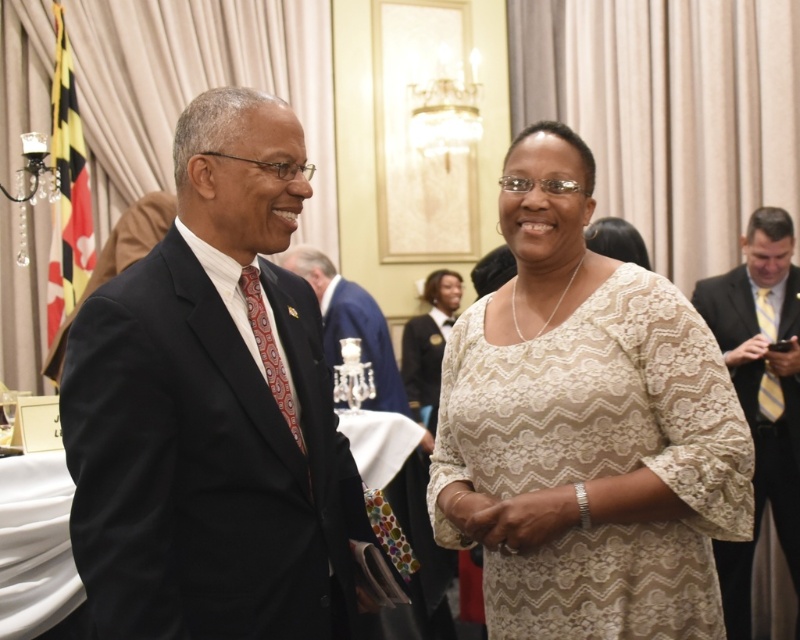
Question: From the image, what is the correct spatial relationship of lace dress at center in relation to matte black suit at center?

Choices:
 (A) right
 (B) left

Answer: (A)

Question: Which of these objects is positioned closest to the lace dress at center?

Choices:
 (A) dark blue suit at center
 (B) matte black suit at center

Answer: (A)

Question: Which is nearer to the lace dress at center?

Choices:
 (A) yellow striped tie at right
 (B) matte black suit at center
 (C) dark blue suit at center

Answer: (C)

Question: Which of the following is the closest to the observer?

Choices:
 (A) yellow striped tie at right
 (B) matte black suit at center
 (C) lace dress at center

Answer: (C)

Question: Can you confirm if lace dress at center is positioned to the right of matte black suit at center?

Choices:
 (A) yes
 (B) no

Answer: (A)

Question: Does lace dress at center have a smaller size compared to yellow striped tie at right?

Choices:
 (A) no
 (B) yes

Answer: (B)